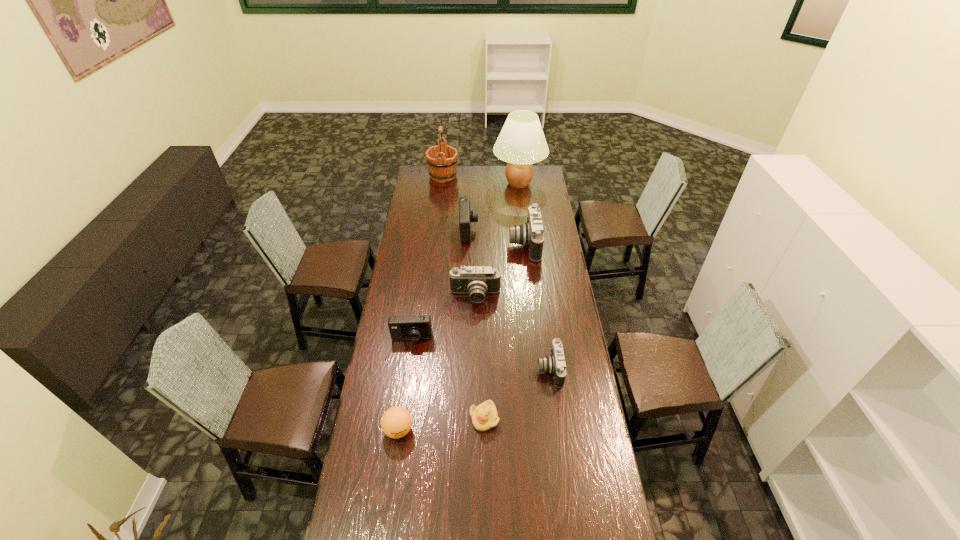
I want to click on lampshade that is positioned at the far edge, so click(x=521, y=142).

The image size is (960, 540). Find the location of `wine bucket present at the far edge`. wine bucket present at the far edge is located at coordinates (442, 159).

Find the location of `wine bucket at the left edge`. wine bucket at the left edge is located at coordinates (442, 159).

Find the location of a particular element. camera that is at the left edge is located at coordinates (417, 327).

Find the location of a particular element. This screenshot has height=540, width=960. ping-pong ball located in the left edge section of the desktop is located at coordinates (396, 422).

Find the location of a particular element. This screenshot has height=540, width=960. lampshade present at the right edge is located at coordinates (521, 142).

I want to click on object that is at the far left corner, so click(442, 159).

This screenshot has height=540, width=960. What are the coordinates of `object that is at the far right corner` in the screenshot? It's located at (521, 142).

You are a GUI agent. You are given a task and a screenshot of the screen. Output one action in this format:
    pyautogui.click(x=<x>, y=<y>)
    Task: Click on the vacant space at the left edge of the desktop
    This screenshot has height=540, width=960.
    Given the screenshot: What is the action you would take?
    point(417,241)

In order to click on free point at the right edge in this screenshot , I will do `click(559, 276)`.